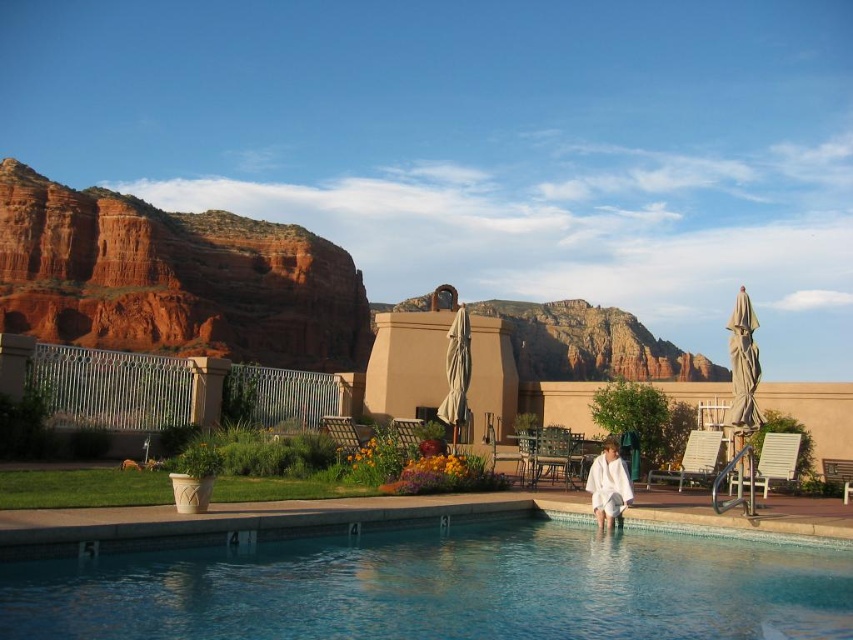
Which is below, reddish-brown rock at upper left or white cotton robe at lower right?

Positioned lower is white cotton robe at lower right.

Is reddish-brown rock at upper left taller than white cotton robe at lower right?

Indeed, reddish-brown rock at upper left has a greater height compared to white cotton robe at lower right.

Is point (241, 237) closer to camera compared to point (590, 480)?

No.

I want to click on reddish-brown rock at upper left, so click(173, 278).

Can you confirm if clear glass swimming pool at lower center is positioned below white cotton robe at lower right?

Indeed, clear glass swimming pool at lower center is positioned under white cotton robe at lower right.

Does clear glass swimming pool at lower center have a greater height compared to white cotton robe at lower right?

Incorrect, clear glass swimming pool at lower center's height is not larger of white cotton robe at lower right's.

The width and height of the screenshot is (853, 640). Identify the location of clear glass swimming pool at lower center. (448, 586).

In order to click on clear glass swimming pool at lower center in this screenshot , I will do `click(448, 586)`.

Is point (45, 577) positioned after point (131, 333)?

That is False.

Based on the photo, between clear glass swimming pool at lower center and reddish-brown rock at upper left, which one has less height?

Standing shorter between the two is clear glass swimming pool at lower center.

Locate an element on the screen. The width and height of the screenshot is (853, 640). clear glass swimming pool at lower center is located at coordinates (448, 586).